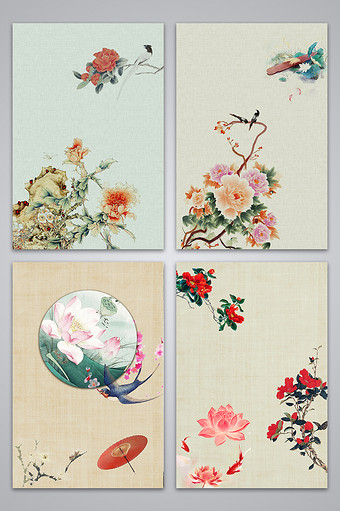
Where is `canvas`? canvas is located at coordinates (293, 87).